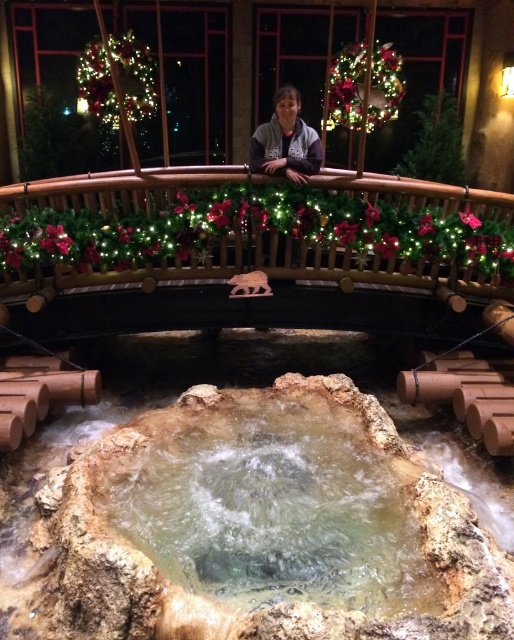
Is translucent rock water at center thinner than gray fleece jacket at upper center?

In fact, translucent rock water at center might be wider than gray fleece jacket at upper center.

Between translucent rock water at center and gray fleece jacket at upper center, which one appears on the right side from the viewer's perspective?

gray fleece jacket at upper center

Is point (208, 432) more distant than point (297, 176)?

No, it is not.

What are the coordinates of `translucent rock water at center` in the screenshot? It's located at (x=269, y=497).